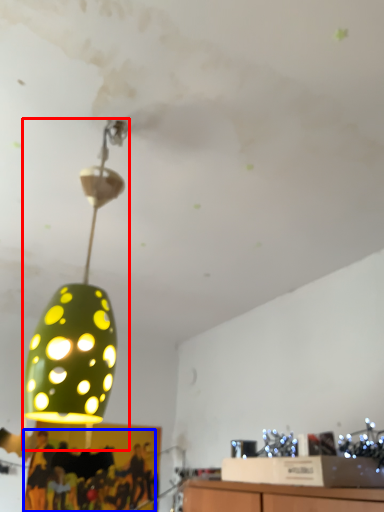
Question: Which object appears farthest to the camera in this image, lamp (highlighted by a red box) or person (highlighted by a blue box)?

Choices:
 (A) lamp
 (B) person

Answer: (B)